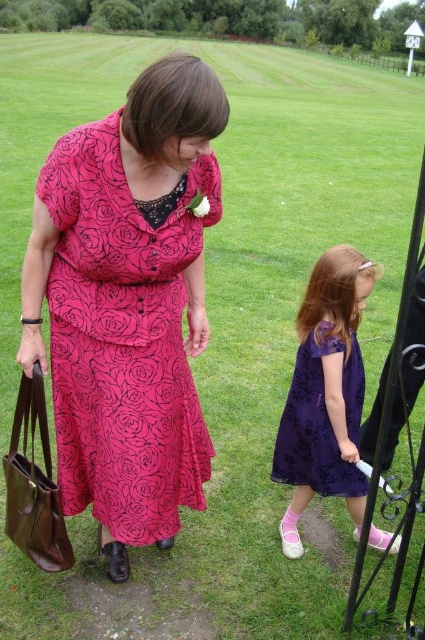
Can you confirm if matte pink dress at center is positioned above purple lace dress at lower right?

Correct, matte pink dress at center is located above purple lace dress at lower right.

The image size is (425, 640). I want to click on matte pink dress at center, so click(x=127, y=304).

At what (x,y) coordinates should I click in order to perform the action: click on matte pink dress at center. Please return your answer as a coordinate pair (x, y). Looking at the image, I should click on (127, 304).

Is matte pink dress at center thinner than purple satin dress at lower right?

No, matte pink dress at center is not thinner than purple satin dress at lower right.

Who is more distant from viewer, (76,234) or (336,388)?

Point (336,388)

You are a GUI agent. You are given a task and a screenshot of the screen. Output one action in this format:
    pyautogui.click(x=<x>, y=<y>)
    Task: Click on the matte pink dress at center
    The height and width of the screenshot is (640, 425).
    Given the screenshot: What is the action you would take?
    pyautogui.click(x=127, y=304)

The height and width of the screenshot is (640, 425). In order to click on matte pink dress at center in this screenshot , I will do `click(127, 304)`.

Who is more forward, (345, 312) or (346, 392)?

Point (345, 312)

Is point (356, 298) positioned behind point (320, 464)?

No, it is not.

The image size is (425, 640). I want to click on purple satin dress at lower right, so click(325, 394).